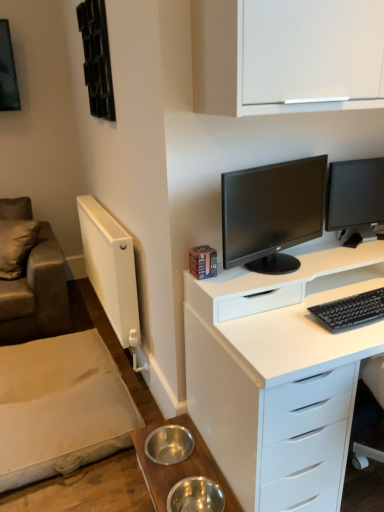
Question: Which direction should I rotate to look at matte black monitor at center, which is the second computer monitor from right to left?

Choices:
 (A) right
 (B) left

Answer: (A)

Question: Considering the relative sizes of white matte cabinet at upper center and black matte keyboard at right in the image provided, is white matte cabinet at upper center shorter than black matte keyboard at right?

Choices:
 (A) no
 (B) yes

Answer: (A)

Question: Does white matte cabinet at upper center come behind black matte keyboard at right?

Choices:
 (A) no
 (B) yes

Answer: (A)

Question: Is white matte cabinet at upper center placed right next to black matte keyboard at right?

Choices:
 (A) no
 (B) yes

Answer: (A)

Question: Can you confirm if white matte cabinet at upper center is positioned to the right of black matte keyboard at right?

Choices:
 (A) yes
 (B) no

Answer: (B)

Question: Does white matte cabinet at upper center have a larger size compared to black matte keyboard at right?

Choices:
 (A) yes
 (B) no

Answer: (A)

Question: From the image's perspective, is white matte cabinet at upper center over black matte keyboard at right?

Choices:
 (A) no
 (B) yes

Answer: (B)

Question: Is the position of black glossy monitor at right, the second computer monitor when ordered from left to right, more distant than that of metallic stainless steel bowls at lower center?

Choices:
 (A) yes
 (B) no

Answer: (A)

Question: Is black glossy monitor at right, the second computer monitor when ordered from left to right, looking in the opposite direction of metallic stainless steel bowls at lower center?

Choices:
 (A) no
 (B) yes

Answer: (A)

Question: Could you tell me if black glossy monitor at right, arranged as the first computer monitor when viewed from the right, is facing metallic stainless steel bowls at lower center?

Choices:
 (A) no
 (B) yes

Answer: (A)

Question: Is black glossy monitor at right, the second computer monitor when ordered from left to right, wider than metallic stainless steel bowls at lower center?

Choices:
 (A) no
 (B) yes

Answer: (A)

Question: Can you confirm if black glossy monitor at right, the second computer monitor when ordered from left to right, is positioned to the left of metallic stainless steel bowls at lower center?

Choices:
 (A) no
 (B) yes

Answer: (A)

Question: From the image's perspective, is black glossy monitor at right, the second computer monitor when ordered from left to right, under metallic stainless steel bowls at lower center?

Choices:
 (A) no
 (B) yes

Answer: (A)

Question: Can you confirm if matte black monitor at center, the 1th computer monitor positioned from the left, is positioned to the right of white matte cabinet at upper center?

Choices:
 (A) no
 (B) yes

Answer: (A)